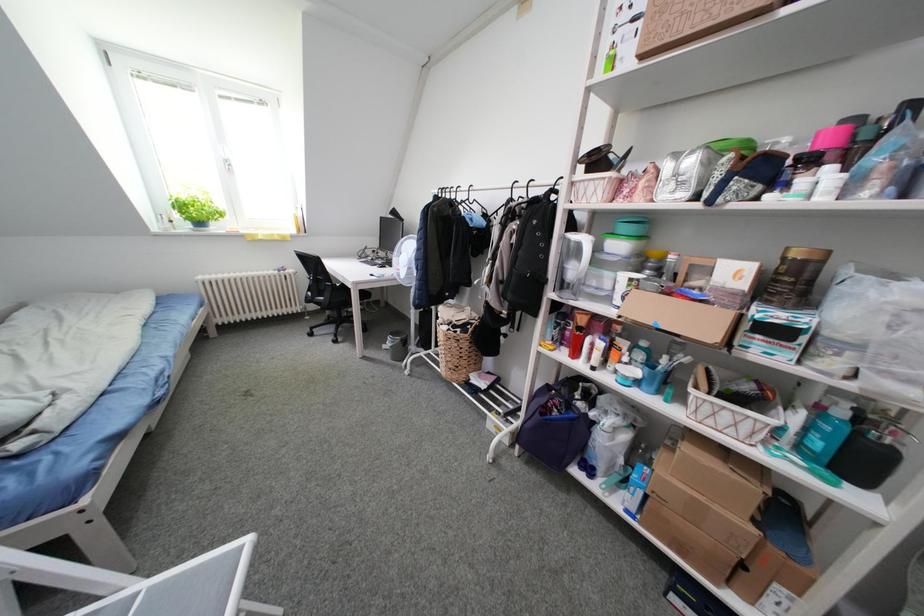
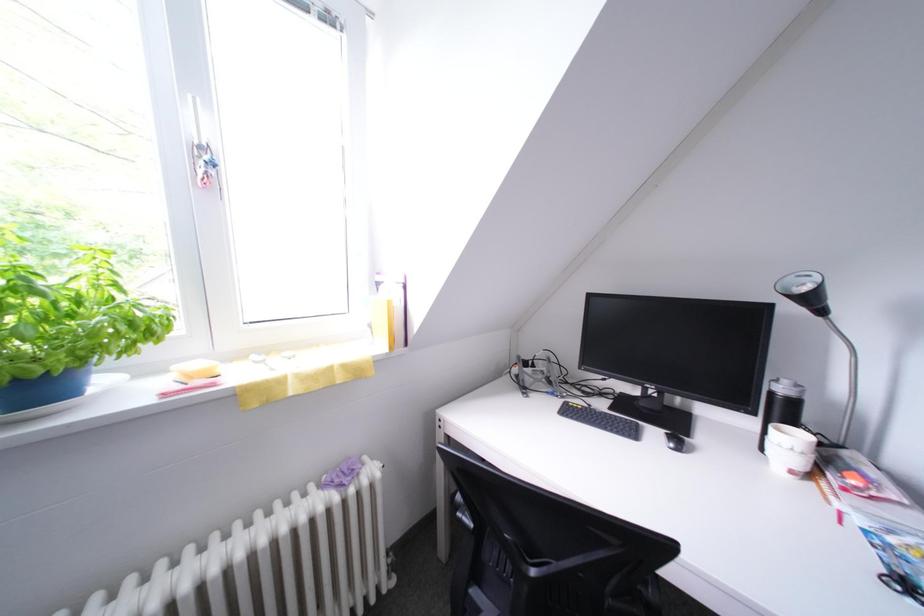
What movement of the cameraman would produce the second image?

The cameraman walked toward left, forward.